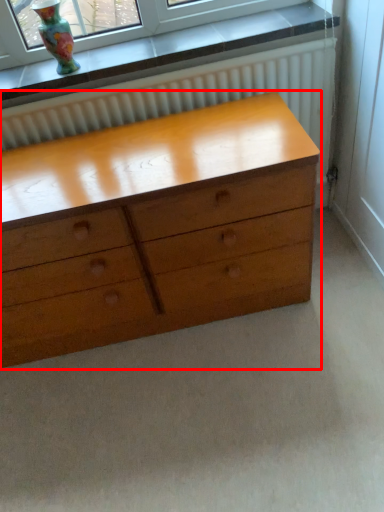
Question: Considering the relative positions of chest of drawers (annotated by the red box) and vase in the image provided, where is chest of drawers (annotated by the red box) located with respect to the staircase?

Choices:
 (A) left
 (B) right

Answer: (B)